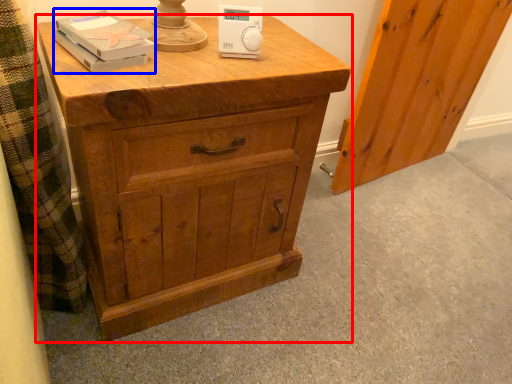
Question: Which of the following is the closest to the observer, chest of drawers (highlighted by a red box) or book (highlighted by a blue box)?

Choices:
 (A) chest of drawers
 (B) book

Answer: (A)